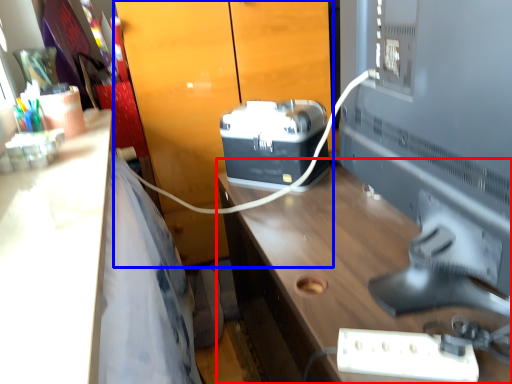
Question: Which object appears farthest to the camera in this image, desk (highlighted by a red box) or dresser (highlighted by a blue box)?

Choices:
 (A) desk
 (B) dresser

Answer: (B)